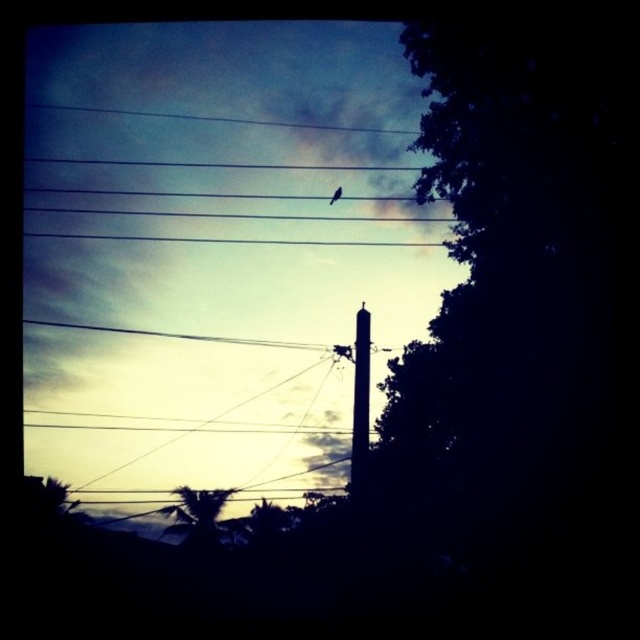
Question: Which of these objects is positioned closest to the green leafy tree at lower left?

Choices:
 (A) black matte bird at upper center
 (B) smooth concrete pole at center
 (C) dark green leafy tree at right

Answer: (B)

Question: Is dark green leafy tree at right thinner than green leafy tree at lower left?

Choices:
 (A) no
 (B) yes

Answer: (A)

Question: Is dark green leafy tree at right positioned behind black matte bird at upper center?

Choices:
 (A) yes
 (B) no

Answer: (B)

Question: Based on their relative distances, which object is farther from the smooth concrete pole at center?

Choices:
 (A) dark green leafy tree at right
 (B) black matte bird at upper center
 (C) green leafy tree at lower left

Answer: (C)

Question: Which of the following is the closest to the observer?

Choices:
 (A) green leafy tree at lower left
 (B) black matte bird at upper center
 (C) smooth concrete pole at center
 (D) dark green leafy tree at right

Answer: (D)

Question: Observing the image, what is the correct spatial positioning of dark green leafy tree at right in reference to smooth concrete pole at center?

Choices:
 (A) below
 (B) above

Answer: (B)